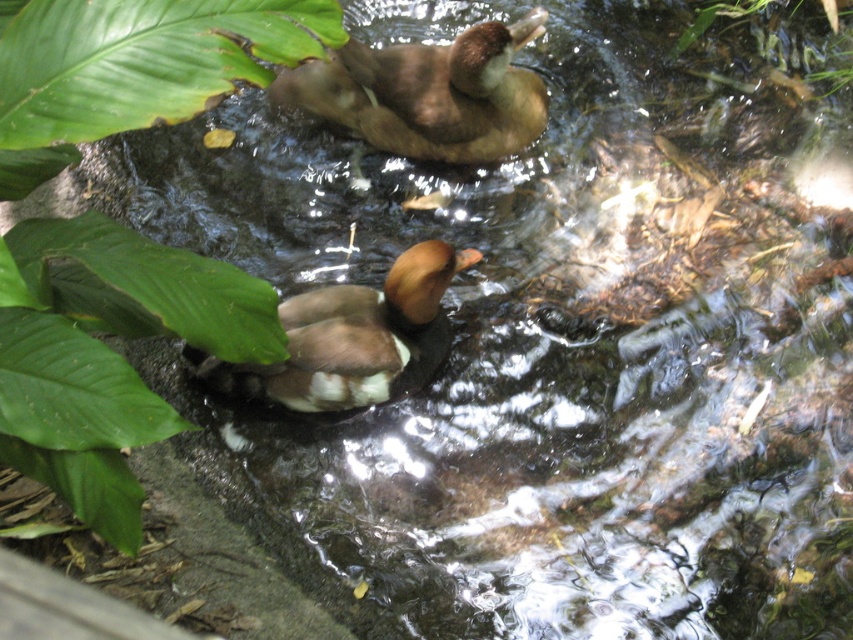
You are a birdwatcher observing the two ducks in the serene pond. Which duck, the brown matte duck at upper center or the brown matte duck at center, is positioned higher up in the image?

The brown matte duck at upper center is positioned higher up in the image than the brown matte duck at center.

You are a gardener who needs to place a 2.5 meter long wooden bench between the green leafy plant at lower left and the green leafy plant at upper right. Based on the scene, will the bench fit between them without bending or moving the plants?

The distance between the green leafy plant at lower left and the green leafy plant at upper right is 2.55 meters, so the 2.5 meter long wooden bench will fit between them without needing to bend or move the plants since the space is slightly larger than the bench.